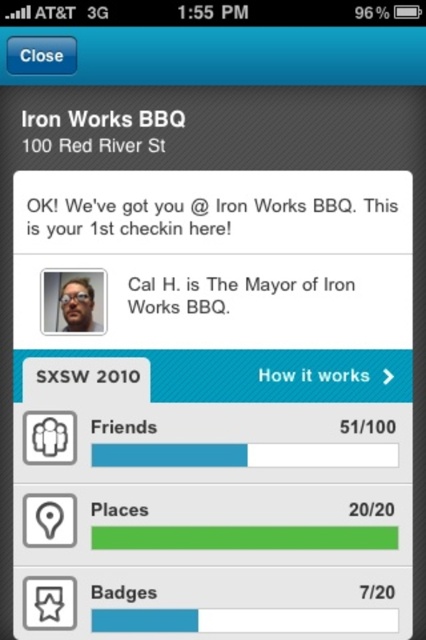
Does black paper text at center have a lesser height compared to black matte text at upper center?

Incorrect, black paper text at center's height does not fall short of black matte text at upper center's.

Measure the distance between point (264, 289) and camera.

They are 4.50 feet apart.

Locate an element on the screen. Image resolution: width=426 pixels, height=640 pixels. black paper text at center is located at coordinates tap(268, 285).

Is black matte text at upper center positioned in front of matte black glasses at upper center?

Yes, it is in front of matte black glasses at upper center.

Is black matte text at upper center bigger than matte black glasses at upper center?

Yes, black matte text at upper center is bigger than matte black glasses at upper center.

Image resolution: width=426 pixels, height=640 pixels. What do you see at coordinates (98, 120) in the screenshot? I see `black matte text at upper center` at bounding box center [98, 120].

Find the location of a particular element. This screenshot has width=426, height=640. black matte text at upper center is located at coordinates (98, 120).

Can you confirm if white paper text at center is wider than black paper text at center?

Correct, the width of white paper text at center exceeds that of black paper text at center.

Does white paper text at center have a larger size compared to black paper text at center?

Indeed, white paper text at center has a larger size compared to black paper text at center.

Where is `white paper text at center`? white paper text at center is located at coordinates (305, 205).